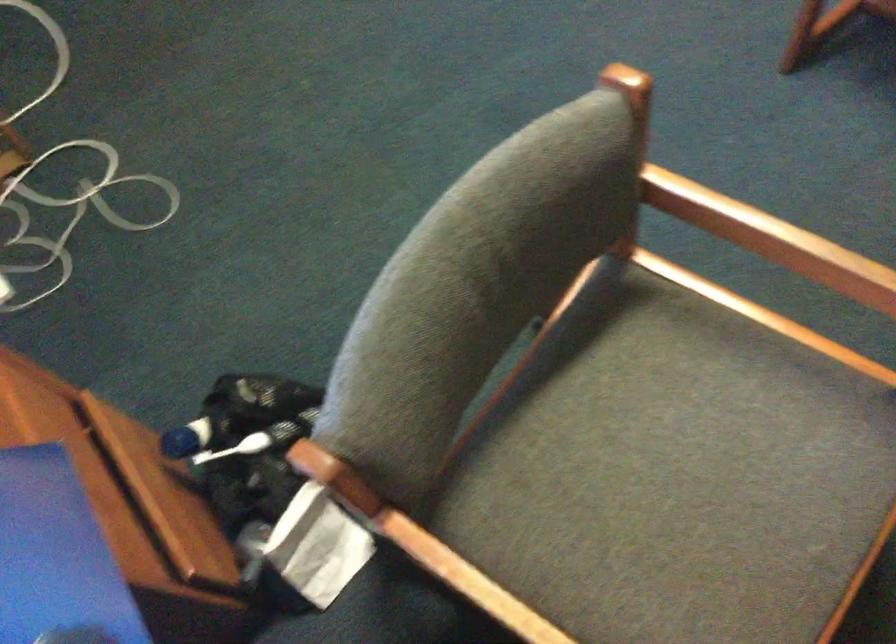
Find the location of a particular element. wooden chair armrest is located at coordinates (433, 576).